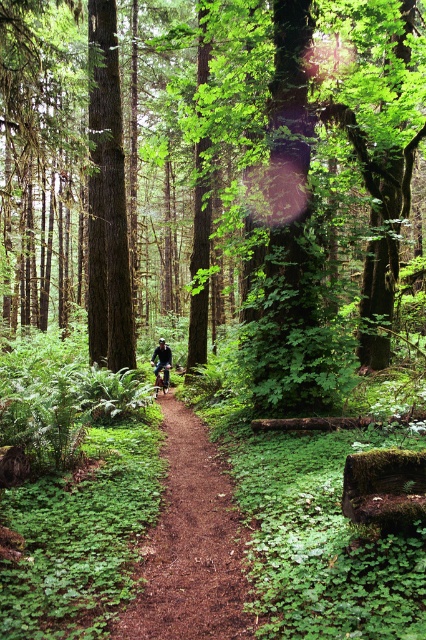
You are a hiker in the forest and see both the black matte bicycle at center and the shiny metallic mountain bike at center on the path. Which bicycle is blocking the other one from your view?

The black matte bicycle at center is positioned over shiny metallic mountain bike at center, so the black matte bicycle at center is blocking the view of the shiny metallic mountain bike at center.

You are a hiker trying to navigate through the forest. You see the brown dirt path at center and the dark brown wood tree at center. Which one is taller?

The dark brown wood tree at center is taller than the brown dirt path at center according to the description.

You are a hiker trying to decide which bike to take on a narrow forest path. You see both the black matte bicycle at center and the shiny metallic mountain bike at center. Which bike would be easier to maneuver on the narrow path?

The shiny metallic mountain bike at center is smaller in size than the black matte bicycle at center, making it easier to maneuver on the narrow forest path.